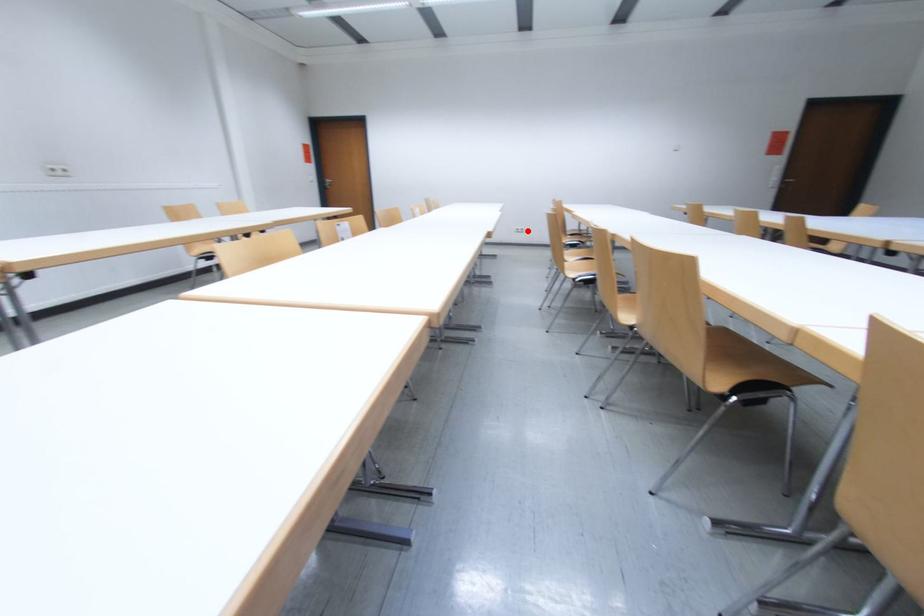
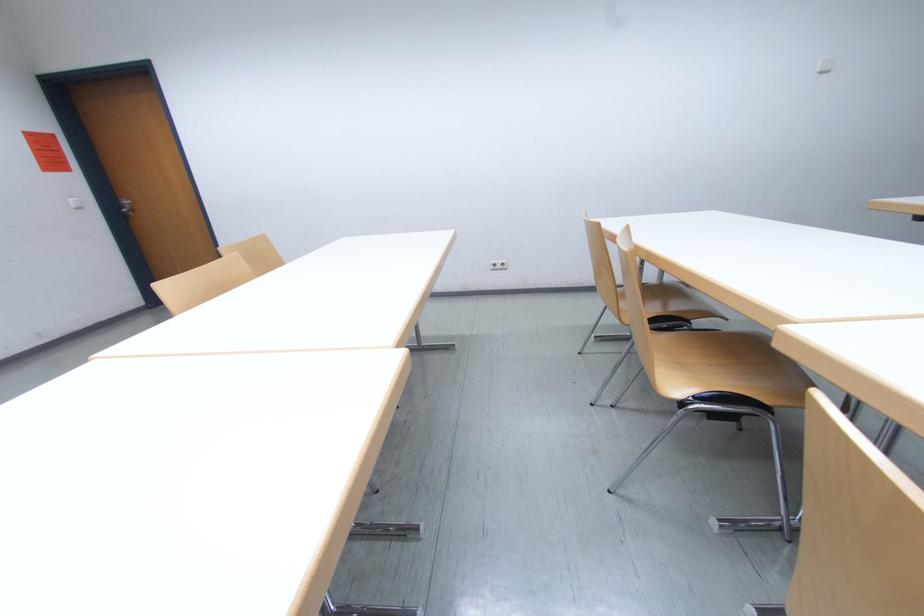
Question: I am providing you with two images of the same scene from different viewpoints. Image1 has a red point marked. In image2, the corresponding 3D location appears at what relative position? Reply with the corresponding letter.

Choices:
 (A) Closer
 (B) Farther

Answer: (B)